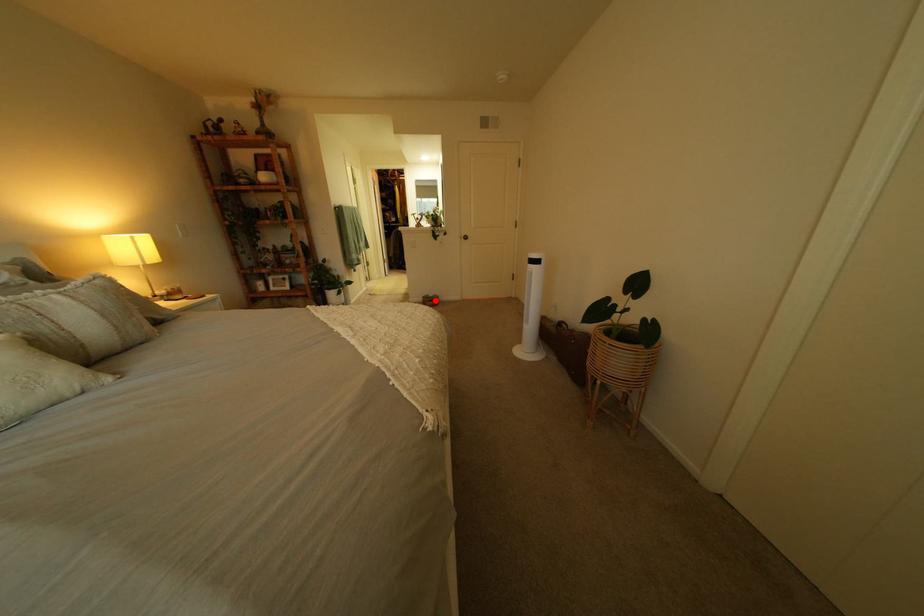
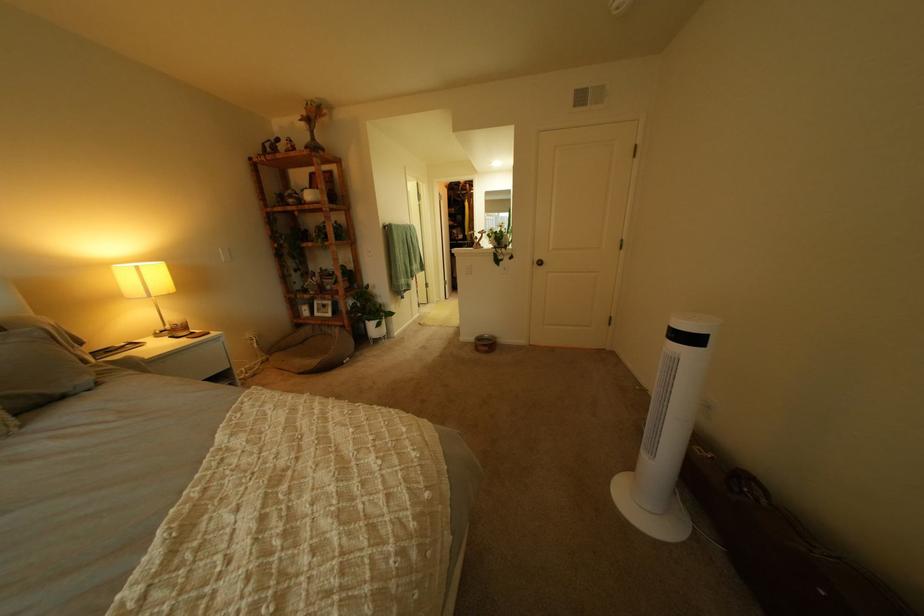
Where in the second image is the point corresponding to the highlighted location from the first image?

(489, 339)